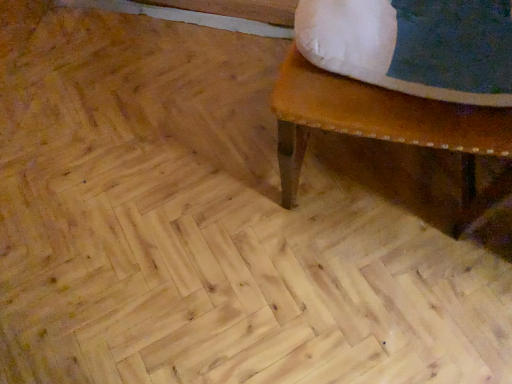
This screenshot has height=384, width=512. Find the location of `vacant space in brown wooden bench at upper right (from a real-world perspective)`. vacant space in brown wooden bench at upper right (from a real-world perspective) is located at coordinates (380, 175).